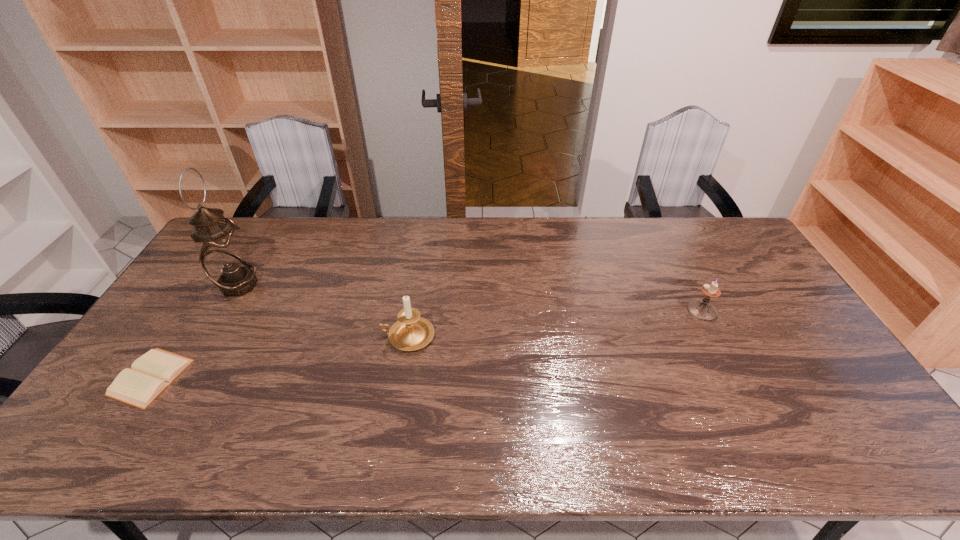
Where is `free space located on the front of the right candle holder`? The image size is (960, 540). free space located on the front of the right candle holder is located at coordinates (742, 387).

This screenshot has height=540, width=960. I want to click on free space located 0.280m on the back of the diary, so click(x=214, y=281).

Identify the location of oil lamp that is positioned at the left edge. The image size is (960, 540). (224, 258).

The image size is (960, 540). I want to click on diary at the left edge, so click(150, 374).

In the image, there is a desktop. Where is `vacant space at the far edge`? This screenshot has height=540, width=960. vacant space at the far edge is located at coordinates (398, 236).

The image size is (960, 540). I want to click on vacant space at the near edge, so click(x=504, y=440).

Find the location of `vacant position at the left edge of the desktop`. vacant position at the left edge of the desktop is located at coordinates (158, 343).

Locate an element on the screen. This screenshot has width=960, height=540. vacant space at the right edge of the desktop is located at coordinates (740, 294).

The width and height of the screenshot is (960, 540). Find the location of `free point between the tallest object and the diary`. free point between the tallest object and the diary is located at coordinates (195, 332).

The width and height of the screenshot is (960, 540). Find the location of `free point between the shortest object and the left candle holder`. free point between the shortest object and the left candle holder is located at coordinates (279, 357).